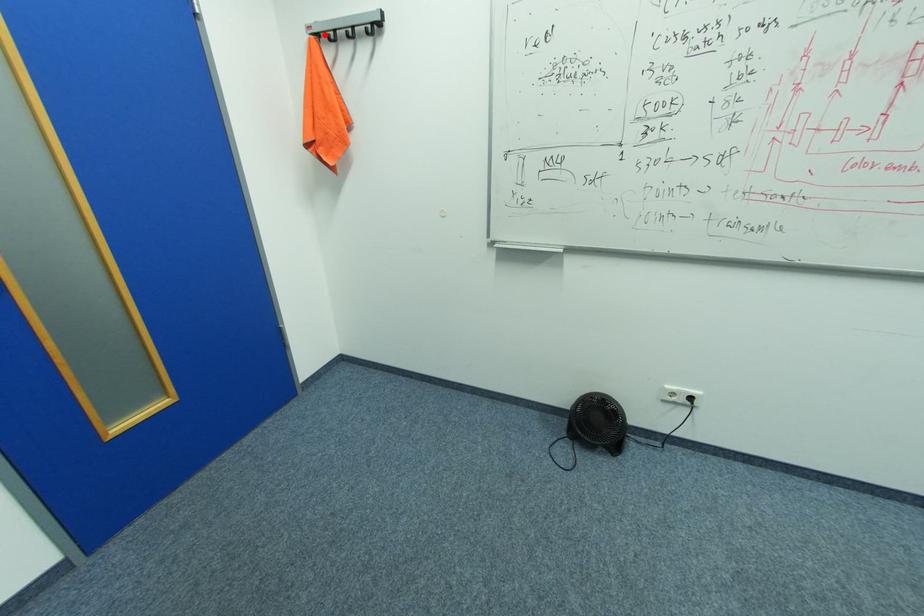
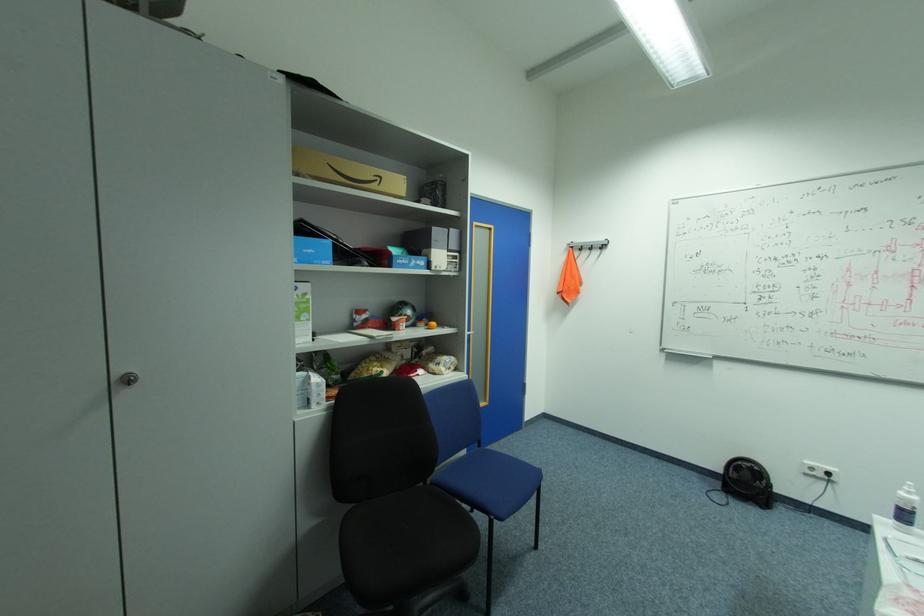
The point at the highlighted location is marked in the first image. Where is the corresponding point in the second image?

(578, 246)